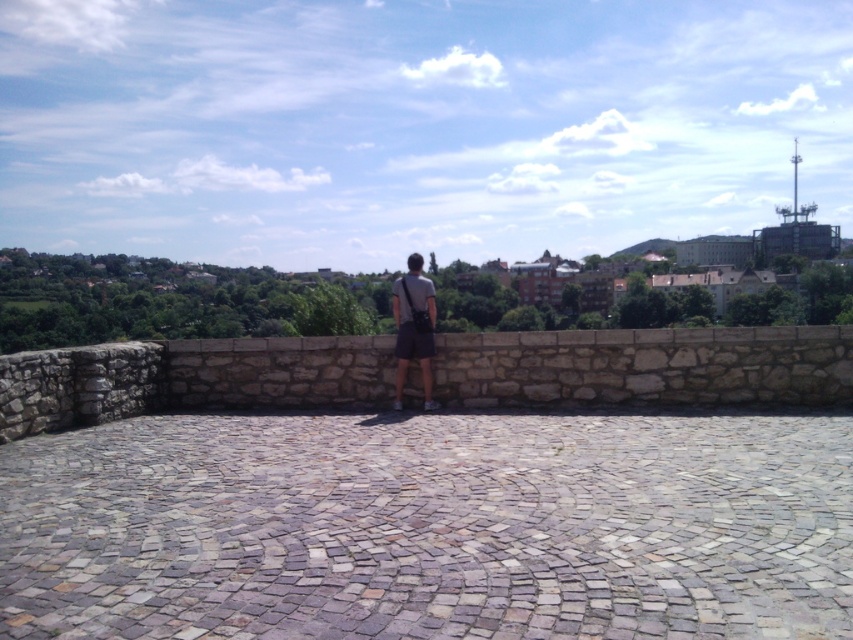
You are standing on the cobblestone platform and want to take a photo of the point at coordinates (242, 355). The camera you have can focus on objects up to 15 meters away. Will the point be in focus?

The distance of point (242, 355) from viewer is 12.03 meters, so yes, the point will be in focus since it is within the camera focus range of 15 meters.